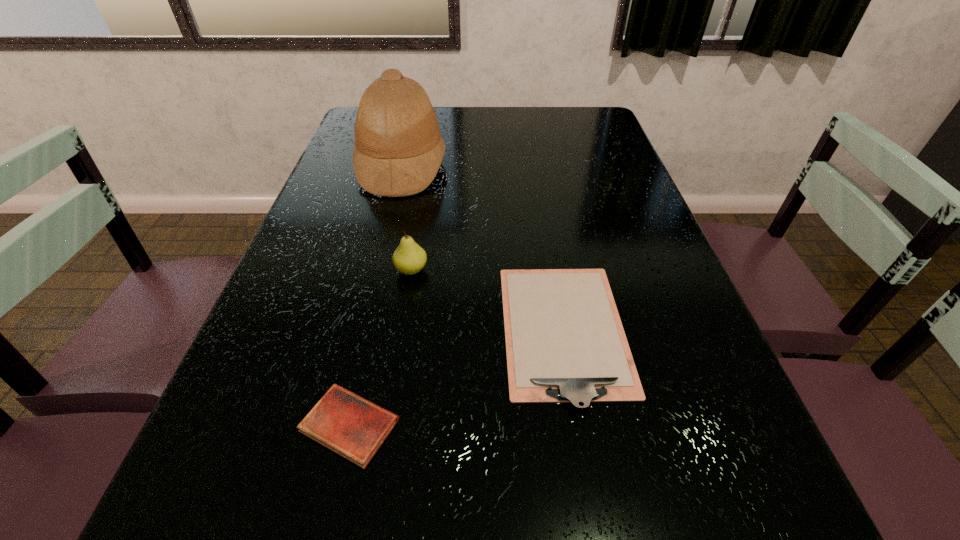
At what (x,y) coordinates should I click in order to perform the action: click on hat present at the left edge. Please return your answer as a coordinate pair (x, y). This screenshot has width=960, height=540. Looking at the image, I should click on (398, 150).

Image resolution: width=960 pixels, height=540 pixels. I want to click on diary located at the left edge, so click(x=351, y=426).

At what (x,y) coordinates should I click in order to perform the action: click on object at the right edge. Please return your answer as a coordinate pair (x, y). This screenshot has height=540, width=960. Looking at the image, I should click on (565, 342).

This screenshot has width=960, height=540. I want to click on vacant space at the far edge of the desktop, so click(490, 137).

I want to click on vacant area at the near edge, so click(x=648, y=532).

Locate an element on the screen. Image resolution: width=960 pixels, height=540 pixels. blank space at the left edge of the desktop is located at coordinates (352, 283).

Where is `free location at the right edge`? This screenshot has width=960, height=540. free location at the right edge is located at coordinates (650, 252).

Locate an element on the screen. This screenshot has height=540, width=960. vacant space at the far right corner of the desktop is located at coordinates (576, 127).

Where is `unoccupied position between the diary and the pear`? The width and height of the screenshot is (960, 540). unoccupied position between the diary and the pear is located at coordinates (380, 348).

Image resolution: width=960 pixels, height=540 pixels. In order to click on free spot between the third shortest object and the farthest object in this screenshot , I will do (406, 218).